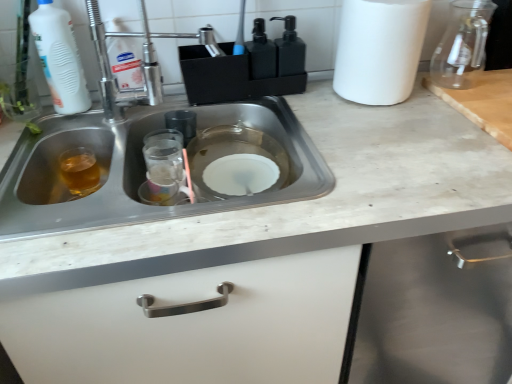
The image size is (512, 384). What are the coordinates of `black matte soap dispenser at upper center` in the screenshot? It's located at (289, 49).

Identify the location of white matte paper towel at upper right. (379, 49).

The image size is (512, 384). Describe the element at coordinates (379, 49) in the screenshot. I see `white matte paper towel at upper right` at that location.

Measure the distance between point (x=56, y=181) and camera.

Point (x=56, y=181) and camera are 98.90 centimeters apart.

This screenshot has width=512, height=384. Describe the element at coordinates (462, 45) in the screenshot. I see `transparent glass jar at upper right` at that location.

What do you see at coordinates (261, 53) in the screenshot? This screenshot has width=512, height=384. I see `black matte soap dispenser at upper center` at bounding box center [261, 53].

I want to click on black matte soap dispenser at upper center, so click(x=289, y=49).

Does point (48, 32) come in front of point (471, 28)?

Yes.

Is white matte bottle at upper left positioned in front of transparent glass jar at upper right?

Yes, it is in front of transparent glass jar at upper right.

You are a GUI agent. You are given a task and a screenshot of the screen. Output one action in this format:
    pyautogui.click(x=<x>, y=<y>)
    Task: Click on the glass jar that is above the white matte bottle at upper left (from the image's perspective)
    The image size is (512, 384).
    Given the screenshot: What is the action you would take?
    [x=462, y=45]

Are black matte soap dispenser at upper center and white matte paper towel at upper right located far from each other?

No.

In the scene shown: Who is smaller, black matte soap dispenser at upper center or white matte paper towel at upper right?

With smaller size is black matte soap dispenser at upper center.

Can you confirm if black matte soap dispenser at upper center is wider than white matte paper towel at upper right?

In fact, black matte soap dispenser at upper center might be narrower than white matte paper towel at upper right.

Where is `soap dispenser on the left of white matte paper towel at upper right`? This screenshot has width=512, height=384. soap dispenser on the left of white matte paper towel at upper right is located at coordinates (289, 49).

From a real-world perspective, is black matte soap dispenser at upper center above or below transparent glass jar at upper right?

black matte soap dispenser at upper center is situated lower than transparent glass jar at upper right in the real world.

Where is `glass jar above the black matte soap dispenser at upper center (from a real-world perspective)`? glass jar above the black matte soap dispenser at upper center (from a real-world perspective) is located at coordinates (462, 45).

Considering the relative positions of black matte soap dispenser at upper center and transparent glass jar at upper right in the image provided, is black matte soap dispenser at upper center to the right of transparent glass jar at upper right from the viewer's perspective?

No, black matte soap dispenser at upper center is not to the right of transparent glass jar at upper right.

Is black matte soap dispenser at upper center not within transparent glass jar at upper right?

Yes, black matte soap dispenser at upper center is located beyond the bounds of transparent glass jar at upper right.

This screenshot has width=512, height=384. I want to click on liquid below the black matte soap dispenser at upper center (from the image's perspective), so click(80, 171).

Is black matte soap dispenser at upper center turned away from translucent amber liquid at sink left?

black matte soap dispenser at upper center is not turned away from translucent amber liquid at sink left.

Considering the positions of objects black matte soap dispenser at upper center and translucent amber liquid at sink left in the image provided, who is behind, black matte soap dispenser at upper center or translucent amber liquid at sink left?

black matte soap dispenser at upper center is further away from the camera.

From the image's perspective, is black matte soap dispenser at upper center positioned above or below translucent amber liquid at sink left?

From the image's perspective, black matte soap dispenser at upper center appears above translucent amber liquid at sink left.

Locate an element on the screen. The image size is (512, 384). cleaning product above the translucent amber liquid at sink left (from a real-world perspective) is located at coordinates (59, 58).

Which of these two, white matte bottle at upper left or translucent amber liquid at sink left, stands taller?

With more height is white matte bottle at upper left.

Is white matte bottle at upper left not within translucent amber liquid at sink left?

white matte bottle at upper left lies outside translucent amber liquid at sink left's area.

Between white matte bottle at upper left and translucent amber liquid at sink left, which one is positioned behind?

translucent amber liquid at sink left is further away from the camera.

Is translucent amber liquid at sink left located within transparent glass jar at upper right?

No, translucent amber liquid at sink left is not inside transparent glass jar at upper right.

Considering their positions, is transparent glass jar at upper right located in front of or behind translucent amber liquid at sink left?

transparent glass jar at upper right is in front of translucent amber liquid at sink left.

Which object is thinner, transparent glass jar at upper right or translucent amber liquid at sink left?

translucent amber liquid at sink left is thinner.

Is stainless steel sink at center far from black matte soap dispenser at upper center?

No.

Does stainless steel sink at center have a larger size compared to black matte soap dispenser at upper center?

Correct, stainless steel sink at center is larger in size than black matte soap dispenser at upper center.

From the image's perspective, is stainless steel sink at center positioned above or below black matte soap dispenser at upper center?

Clearly, from the image's perspective, stainless steel sink at center is below black matte soap dispenser at upper center.

Consider the image. Is stainless steel sink at center to the left or to the right of black matte soap dispenser at upper center in the image?

In the image, stainless steel sink at center appears on the left side of black matte soap dispenser at upper center.

Find the location of a particular element. glass jar located underneath the white matte bottle at upper left (from a real-world perspective) is located at coordinates point(462,45).

This screenshot has height=384, width=512. In order to click on soap dispenser located behind the white matte paper towel at upper right in this screenshot , I will do `click(289, 49)`.

Estimate the real-world distances between objects in this image. Which object is closer to transparent glass jar at upper right, white matte bottle at upper left or black matte soap dispenser at upper center?

black matte soap dispenser at upper center lies closer to transparent glass jar at upper right than the other object.

Estimate the real-world distances between objects in this image. Which object is further from black matte soap dispenser at upper center, white matte bottle at upper left or black matte soap dispenser at upper center?

The object further to black matte soap dispenser at upper center is white matte bottle at upper left.

Based on the photo, based on their spatial positions, is white matte bottle at upper left or black matte soap dispenser at upper center further from black matte soap dispenser at upper center?

The object further to black matte soap dispenser at upper center is white matte bottle at upper left.

Considering their positions, is white matte bottle at upper left positioned further to black matte soap dispenser at upper center than transparent glass jar at upper right?

Based on the image, transparent glass jar at upper right appears to be further to black matte soap dispenser at upper center.

From the picture: Based on their spatial positions, is black matte soap dispenser at upper center or translucent amber liquid at sink left closer to transparent glass jar at upper right?

The object closer to transparent glass jar at upper right is black matte soap dispenser at upper center.

Estimate the real-world distances between objects in this image. Which object is further from white matte bottle at upper left, white matte paper towel at upper right or translucent amber liquid at sink left?

white matte paper towel at upper right lies further to white matte bottle at upper left than the other object.

Looking at the image, which one is located further to black matte soap dispenser at upper center, stainless steel sink at center or white matte bottle at upper left?

white matte bottle at upper left is positioned further to the anchor black matte soap dispenser at upper center.

Looking at the image, which one is located further to white matte bottle at upper left, transparent glass jar at upper right or black matte soap dispenser at upper center?

The object further to white matte bottle at upper left is transparent glass jar at upper right.

Locate an element on the screen. liquid between white matte bottle at upper left and black matte soap dispenser at upper center from left to right is located at coordinates (80, 171).

The height and width of the screenshot is (384, 512). What are the coordinates of `liquid situated between white matte bottle at upper left and white matte paper towel at upper right from left to right` in the screenshot? It's located at (80, 171).

Image resolution: width=512 pixels, height=384 pixels. Identify the location of soap dispenser located between black matte soap dispenser at upper center and white matte paper towel at upper right in the left-right direction. (289, 49).

Where is `paper towel located between black matte soap dispenser at upper center and transparent glass jar at upper right in the left-right direction`? paper towel located between black matte soap dispenser at upper center and transparent glass jar at upper right in the left-right direction is located at coordinates (379, 49).